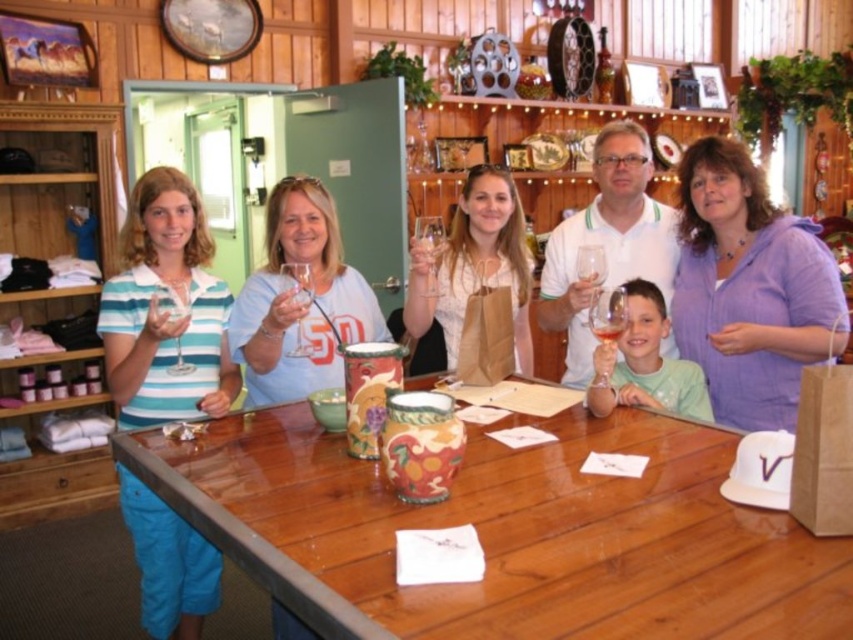
Question: Is matte blue shirt at left behind matte blue shirt at center?

Choices:
 (A) no
 (B) yes

Answer: (A)

Question: In this image, where is wooden table at center located relative to white matte shirt at center?

Choices:
 (A) above
 (B) below

Answer: (B)

Question: Estimate the real-world distances between objects in this image. Which object is farther from the translucent glass at center?

Choices:
 (A) purple cotton shirt at center
 (B) light green fabric shirt at center

Answer: (A)

Question: Is purple cotton shirt at center smaller than matte blue shirt at center?

Choices:
 (A) no
 (B) yes

Answer: (A)

Question: Which object is closer to the camera taking this photo?

Choices:
 (A) light green fabric shirt at center
 (B) purple cotton shirt at center
 (C) wooden table at center
 (D) white matte shirt at center

Answer: (C)

Question: Which object appears farthest from the camera in this image?

Choices:
 (A) light green fabric shirt at center
 (B) matte blue shirt at left
 (C) wooden table at center

Answer: (A)